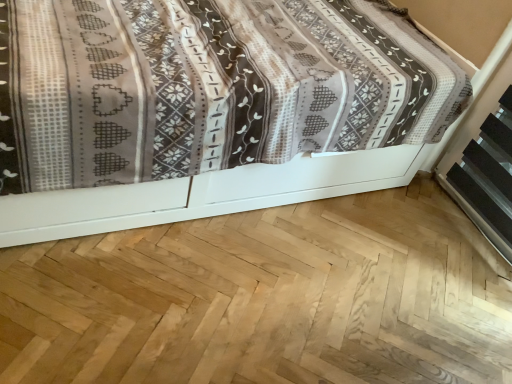
Question: Should I look upward or downward to see patterned fabric bed at upper left?

Choices:
 (A) up
 (B) down

Answer: (A)